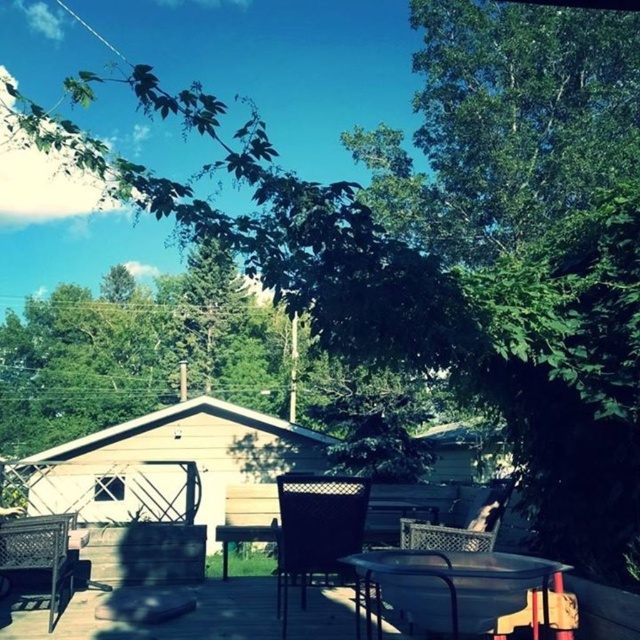
Does black woven chair at center have a lesser width compared to rustic wicker chair at lower left?

Yes, black woven chair at center is thinner than rustic wicker chair at lower left.

How distant is black woven chair at center from rustic wicker chair at lower left?

black woven chair at center and rustic wicker chair at lower left are 1.86 meters apart from each other.

Between point (294, 576) and point (58, 552), which one is positioned in front?

Point (58, 552)

Where is `black woven chair at center`? The height and width of the screenshot is (640, 640). black woven chair at center is located at coordinates (316, 529).

Which of these two, tan wood cabin at center or black woven chair at center, stands shorter?

Standing shorter between the two is black woven chair at center.

Who is more distant from viewer, (195, 412) or (352, 499)?

The point (195, 412) is more distant.

Locate an element on the screen. tan wood cabin at center is located at coordinates (177, 468).

Does metallic silver table at lower center have a larger size compared to black woven chair at center?

Incorrect, metallic silver table at lower center is not larger than black woven chair at center.

Is metallic silver table at lower center to the right of black woven chair at center from the viewer's perspective?

Correct, you'll find metallic silver table at lower center to the right of black woven chair at center.

Between point (358, 614) and point (323, 500), which one is positioned behind?

The point (358, 614) is more distant.

Image resolution: width=640 pixels, height=640 pixels. Identify the location of metallic silver table at lower center. (449, 588).